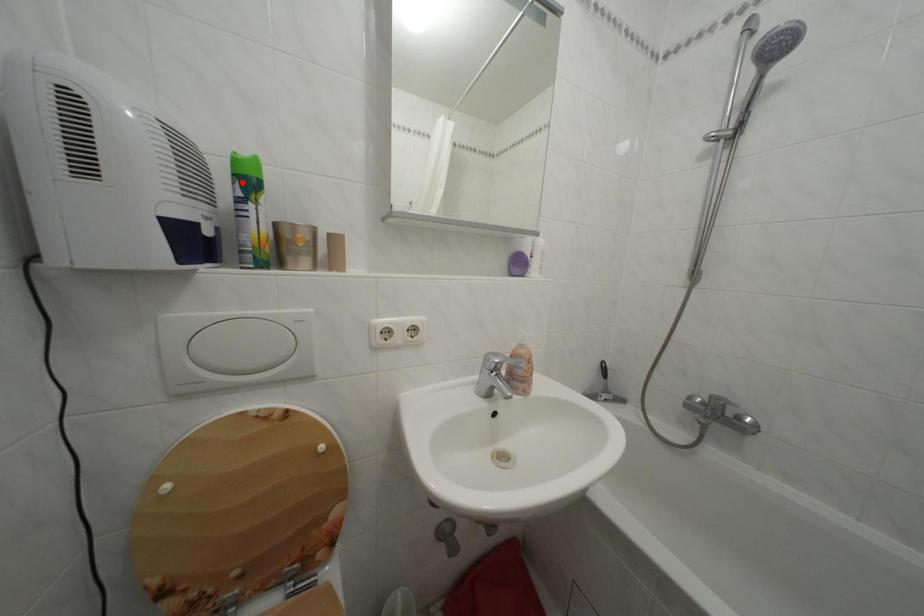
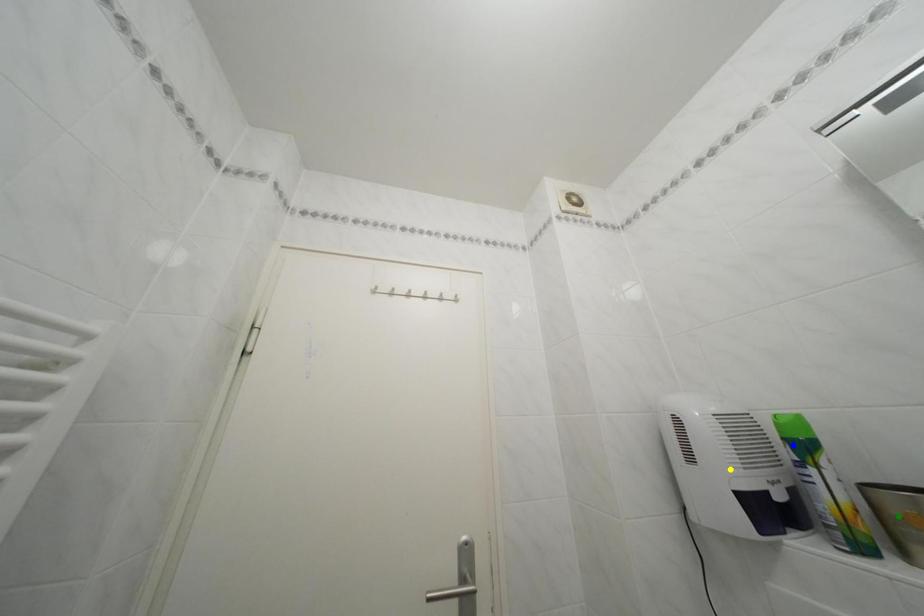
Question: I am providing you with two images of the same scene from different viewpoints. A red point is marked on the first image. You are given multiple points on the second image. Which spot in image 2 lines up with the point in image 1?

Choices:
 (A) yellow point
 (B) green point
 (C) blue point

Answer: (C)